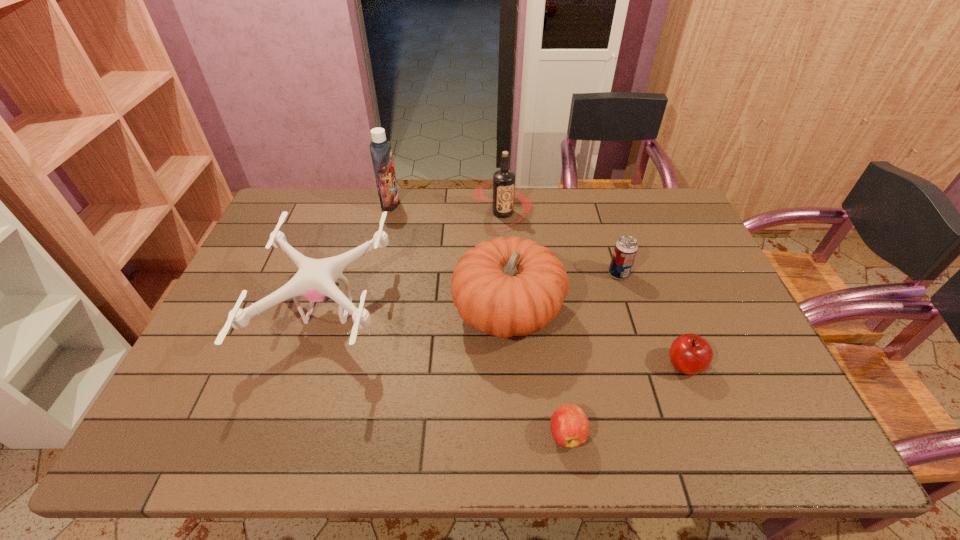
Find the location of `the tallest object`. the tallest object is located at coordinates (381, 153).

Identify the location of root beer. (503, 184).

I want to click on the third tallest object, so click(x=505, y=287).

Image resolution: width=960 pixels, height=540 pixels. I want to click on the fourth shortest object, so click(x=315, y=280).

At what (x,y) coordinates should I click in order to perform the action: click on beer can. Please return your answer as a coordinate pair (x, y). Looking at the image, I should click on (626, 248).

Where is `the fifth tallest object`? the fifth tallest object is located at coordinates (626, 248).

Where is `the farther apple`? This screenshot has width=960, height=540. the farther apple is located at coordinates (690, 354).

Where is `the rightmost object`? the rightmost object is located at coordinates (690, 354).

Where is `the left apple`? the left apple is located at coordinates (570, 428).

At what (x,y) coordinates should I click in order to perform the action: click on the nearest object. Please return your answer as a coordinate pair (x, y). Looking at the image, I should click on (570, 428).